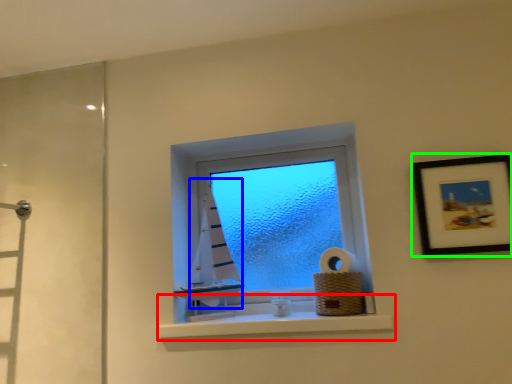
Question: Based on their relative distances, which object is nearer to window sill (highlighted by a red box)? Choose from curtain (highlighted by a blue box) and picture frame (highlighted by a green box).

Choices:
 (A) curtain
 (B) picture frame

Answer: (A)